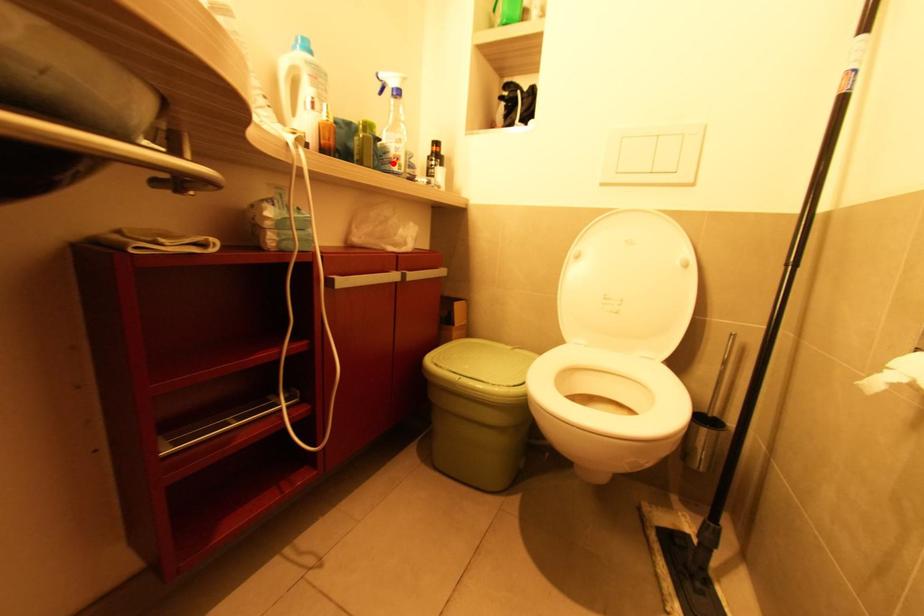
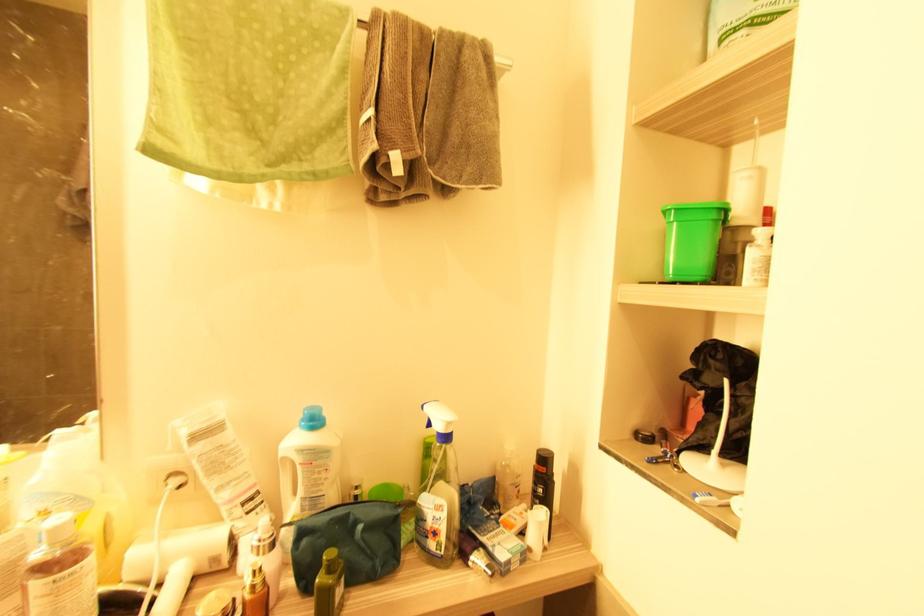
Question: A red point is marked in image1. In image2, is the corresponding 3D point closer to the camera or farther? Reply with the corresponding letter.

Choices:
 (A) The corresponding 3D point is closer.
 (B) The corresponding 3D point is farther.

Answer: (B)